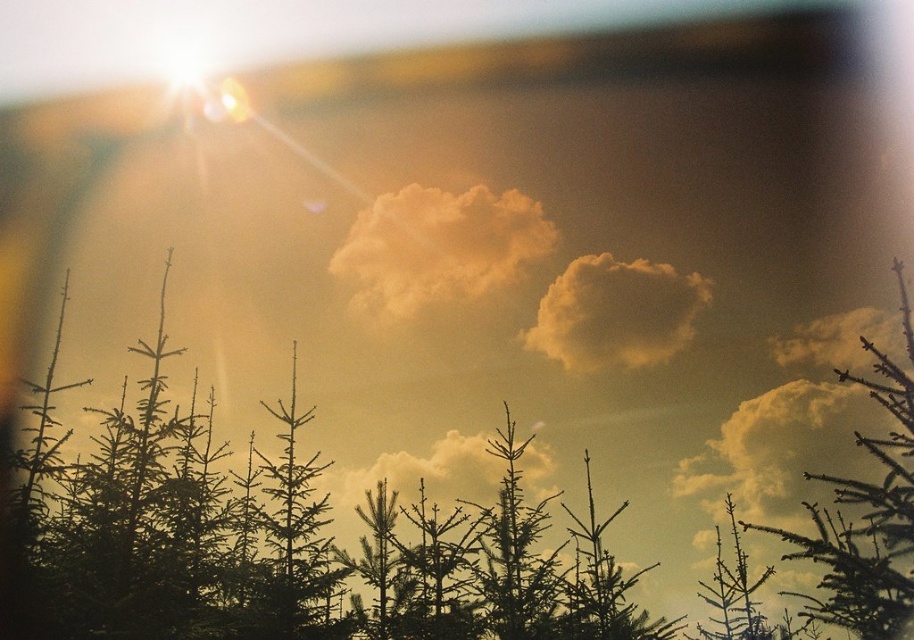
What do you see at coordinates (781, 448) in the screenshot? The width and height of the screenshot is (914, 640). I see `fuzzy yellow cloud at upper center` at bounding box center [781, 448].

Can you confirm if fuzzy yellow cloud at upper center is positioned below cloudy at center?

Incorrect, fuzzy yellow cloud at upper center is not positioned below cloudy at center.

You are a GUI agent. You are given a task and a screenshot of the screen. Output one action in this format:
    pyautogui.click(x=<x>, y=<y>)
    Task: Click on the fuzzy yellow cloud at upper center
    
    Given the screenshot: What is the action you would take?
    pyautogui.click(x=781, y=448)

Image resolution: width=914 pixels, height=640 pixels. I want to click on fuzzy yellow cloud at upper center, so click(x=781, y=448).

Which is above, fuzzy golden cloud at upper center or cloudy white cloud at upper right?

fuzzy golden cloud at upper center is higher up.

Which is behind, point (613, 321) or point (772, 342)?

The point (772, 342) is behind.

This screenshot has height=640, width=914. What do you see at coordinates (615, 314) in the screenshot? I see `fuzzy golden cloud at upper center` at bounding box center [615, 314].

Where is `fuzzy golden cloud at upper center`? fuzzy golden cloud at upper center is located at coordinates (615, 314).

Can you confirm if soft yellow cloud at upper center is shorter than fuzzy yellow cloud at upper center?

Yes.

Can you confirm if soft yellow cloud at upper center is positioned to the right of fuzzy yellow cloud at upper center?

In fact, soft yellow cloud at upper center is to the left of fuzzy yellow cloud at upper center.

Between point (420, 266) and point (838, 432), which one is positioned in front?

Point (838, 432)

In order to click on soft yellow cloud at upper center in this screenshot , I will do `click(438, 250)`.